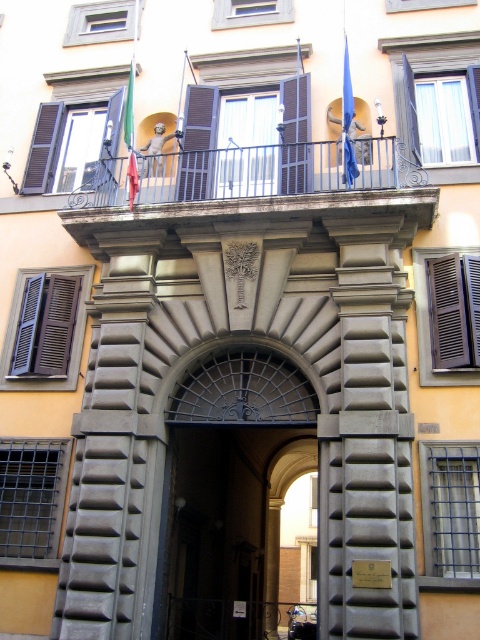
You are a painter hired to paint the entrance of this classical building. You need to decide which object requires more paint based on their heights. Which object should you allocate more paint to, the metallic gray railing at upper center or the brown wooden shutter at left?

The brown wooden shutter at left is taller than the metallic gray railing at upper center, so you should allocate more paint to the brown wooden shutter at left.

Looking at this image, you are a window cleaner who needs to clean the shutters on the building. You have a ladder that can reach up to 10 meters. The brown wooden shutter at upper center and the brown wooden shutters at upper center are both located at the same height. Which one requires more effort to clean due to its size?

The brown wooden shutters at upper center require more effort to clean because they are larger than the brown wooden shutter at upper center, even though both are at the same height.